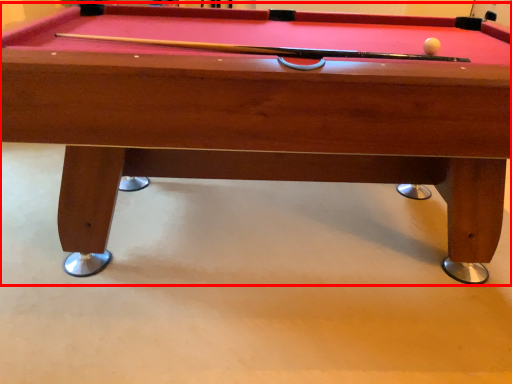
Question: From the image's perspective, where is billiard table (annotated by the red box) located in relation to ball in the image?

Choices:
 (A) below
 (B) above

Answer: (A)